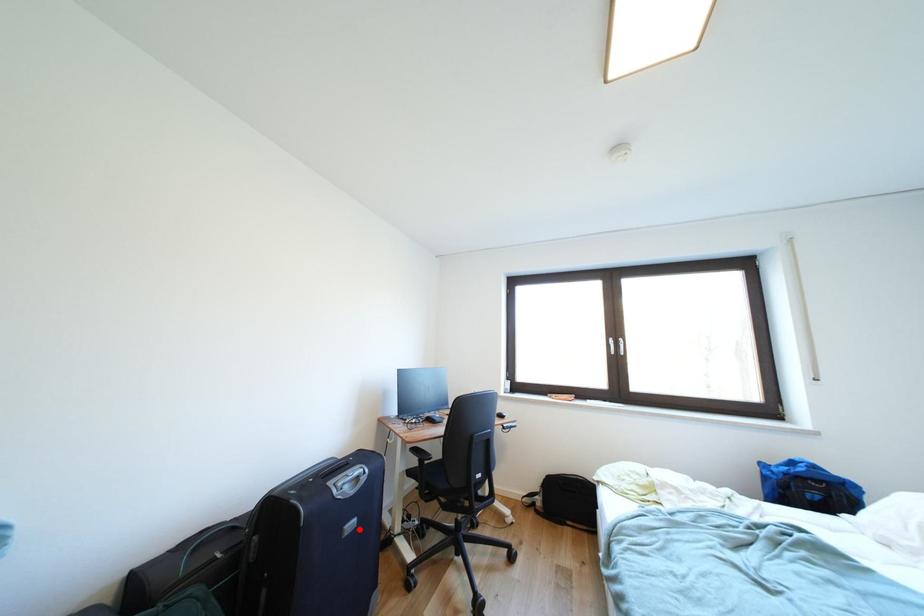
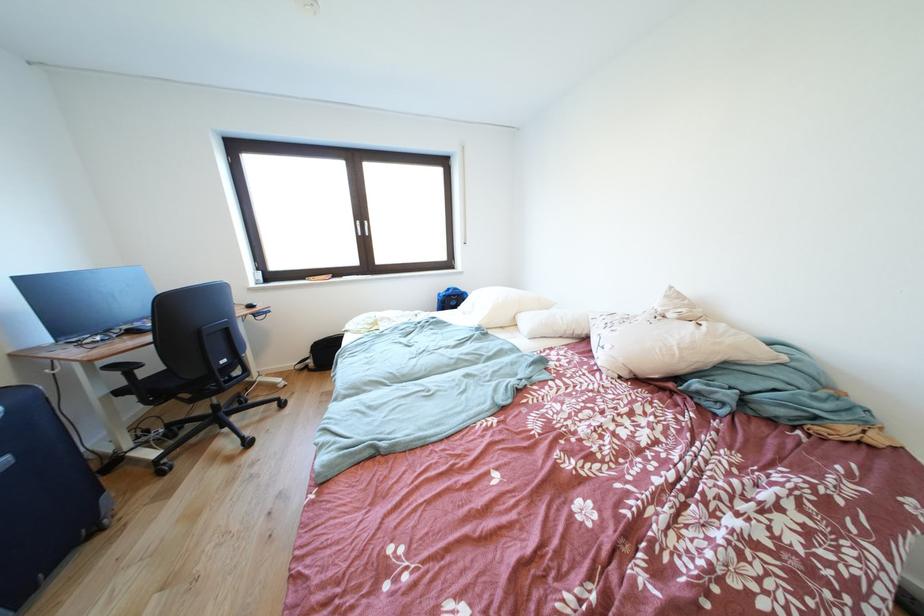
Find the pixel in the second image that matches the highlighted location in the first image.

(8, 468)